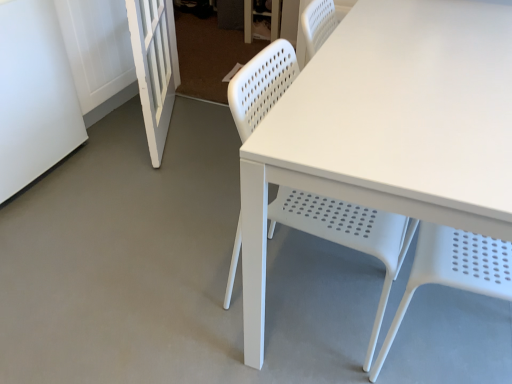
Find the location of a particular element. This screenshot has width=512, height=384. free space in front of white matte screen door at left, the 1th screen door viewed from the right is located at coordinates (148, 180).